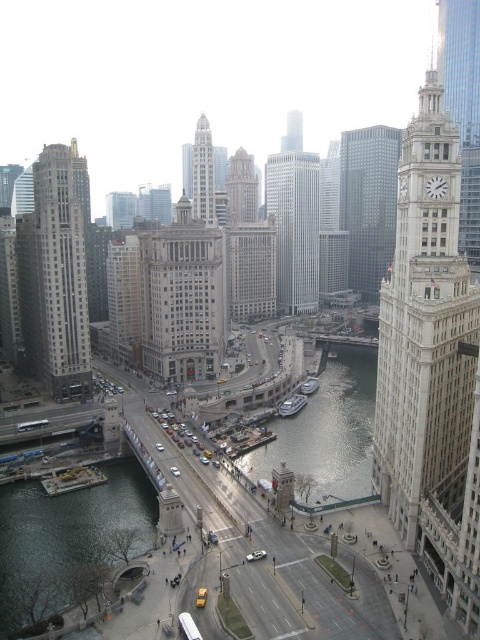
You are a delivery drone operator. Your drone needs to deliver a package to a boat on the river. The white plastic boat at center and the metallic gray boat at center are both in the delivery area. The drone can only deliver to boats within a 10 meter radius. Can the drone deliver to both boats?

The white plastic boat at center is 11.91 meters from the metallic gray boat at center. Since the distance between them is greater than 10 meters, the drone cannot deliver to both boats within the same 10 meter radius.

You are standing at the point labeled as point [296,305] in the city. A friend is at your current location and wants to know how far they are from you. What should you tell them?

The point [296,305] is 1100.98 feet away from the viewer, so you should inform your friend that they are 1100.98 feet away from you.

You are a drone operator who needs to fly a drone from the silver glass skyscraper at center to the metallic gray boat at center. The drone has a maximum flight range of 150 meters. Can the drone reach the boat without needing to recharge?

The distance between the silver glass skyscraper at center and the metallic gray boat at center is 152.21 meters. Since the drone can only fly up to 150 meters without recharging, it cannot reach the boat without needing to recharge.